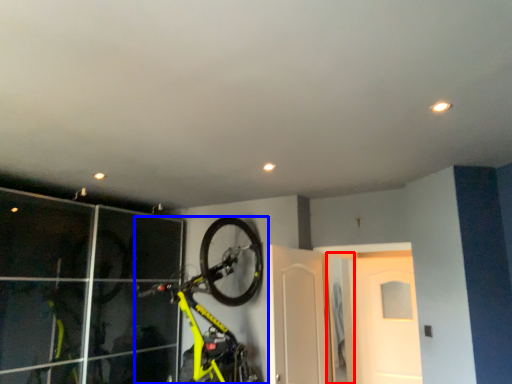
Question: Which of the following is the closest to the observer, door (highlighted by a red box) or bicycle (highlighted by a blue box)?

Choices:
 (A) door
 (B) bicycle

Answer: (B)